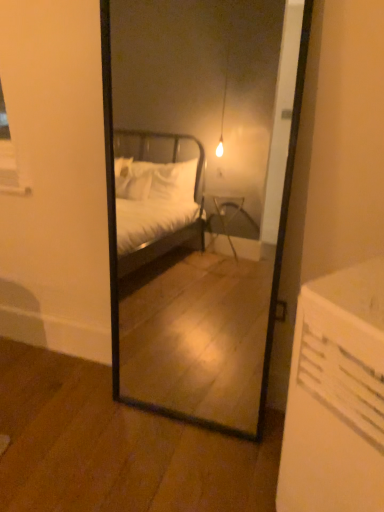
Find the location of `white plastic air conditioner at lower right`. white plastic air conditioner at lower right is located at coordinates (336, 396).

This screenshot has width=384, height=512. What do you see at coordinates (336, 396) in the screenshot?
I see `white plastic air conditioner at lower right` at bounding box center [336, 396].

Find the location of `white plastic air conditioner at lower right`. white plastic air conditioner at lower right is located at coordinates (336, 396).